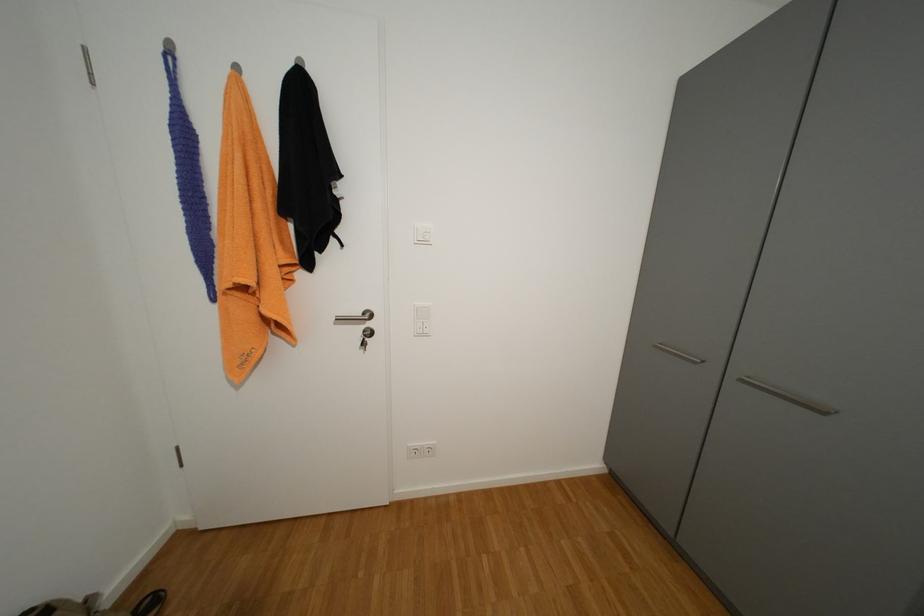
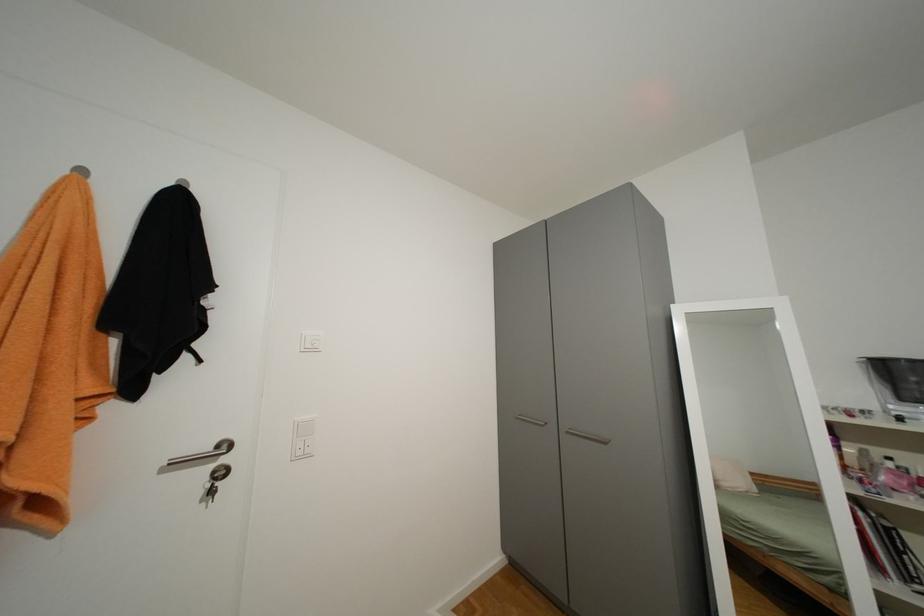
The first image is from the beginning of the video and the second image is from the end. How did the camera likely rotate when shooting the video?

The camera rotated toward right-up.